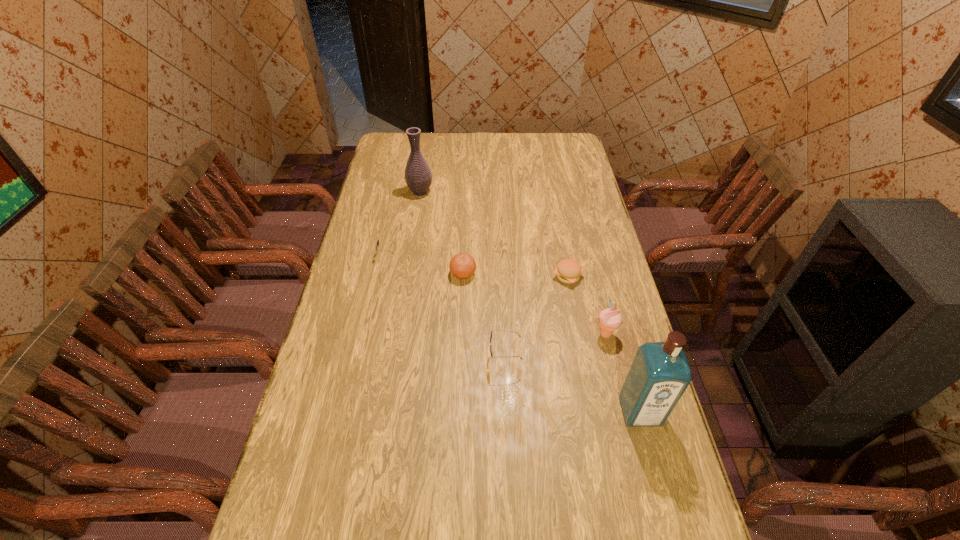
You are a GUI agent. You are given a task and a screenshot of the screen. Output one action in this format:
    pyautogui.click(x=<x>, y=<y>)
    Task: Click on the empty space that is in between the liquor and the farthest object
    Image resolution: width=960 pixels, height=540 pixels.
    Given the screenshot: What is the action you would take?
    pyautogui.click(x=530, y=301)

At what (x,y) coordinates should I click in order to perform the action: click on free area in between the nearer sunglasses and the fifth shortest object. Please return your answer as a coordinate pair (x, y). The image size is (960, 540). Looking at the image, I should click on (555, 347).

You are a GUI agent. You are given a task and a screenshot of the screen. Output one action in this format:
    pyautogui.click(x=<x>, y=<y>)
    Task: Click on the free area in between the nearest object and the farthest object
    Image resolution: width=960 pixels, height=540 pixels.
    Given the screenshot: What is the action you would take?
    pyautogui.click(x=530, y=301)

You are a GUI agent. You are given a task and a screenshot of the screen. Output one action in this format:
    pyautogui.click(x=<x>, y=<y>)
    Task: Click on the free spot between the sixth shortest object and the clementine
    
    Given the screenshot: What is the action you would take?
    coord(442,233)

Where is `vacant space that's between the fifth object from right to left and the hamburger`? The height and width of the screenshot is (540, 960). vacant space that's between the fifth object from right to left and the hamburger is located at coordinates (516, 275).

At what (x,y) coordinates should I click in order to perform the action: click on vacant space that is in between the hamburger and the clementine. Please return your answer as a coordinate pair (x, y). This screenshot has height=540, width=960. Looking at the image, I should click on (516, 275).

The image size is (960, 540). In order to click on unoccupied position between the nearest object and the clementine in this screenshot , I will do `click(551, 342)`.

Find the location of a particular element. This screenshot has height=540, width=960. free spot between the shorter sunglasses and the nearest object is located at coordinates (514, 333).

Where is `unoccupied position between the farthest object and the fifth shortest object`? unoccupied position between the farthest object and the fifth shortest object is located at coordinates (513, 263).

You are a GUI agent. You are given a task and a screenshot of the screen. Output one action in this format:
    pyautogui.click(x=<x>, y=<y>)
    Task: Click on the object that is the nearest to the hamburger
    This screenshot has width=960, height=540.
    Given the screenshot: What is the action you would take?
    pyautogui.click(x=610, y=319)